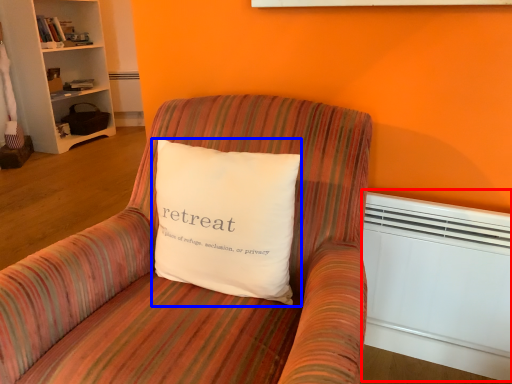
Question: Which point is closer to the camera, heater (highlighted by a red box) or pillow (highlighted by a blue box)?

Choices:
 (A) heater
 (B) pillow

Answer: (B)